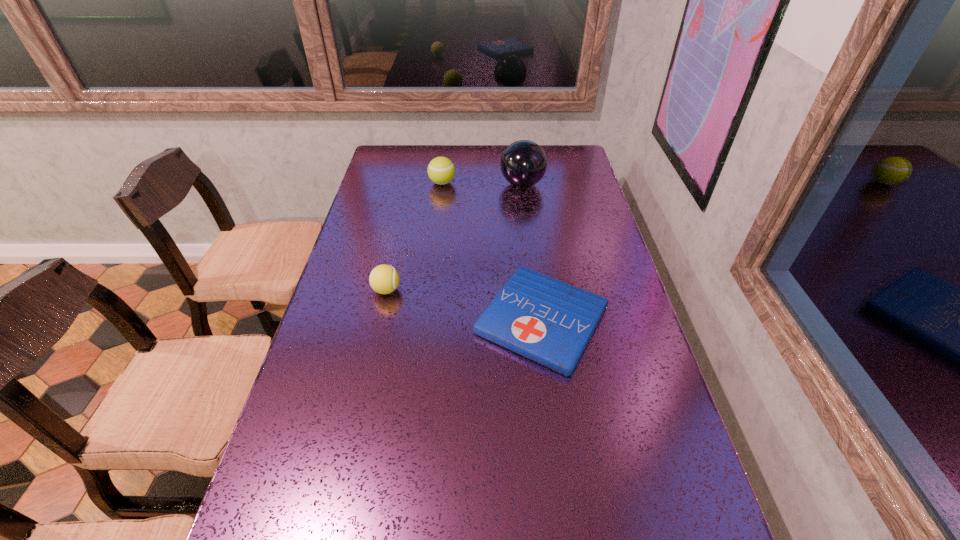
Image resolution: width=960 pixels, height=540 pixels. I want to click on bowling ball, so click(x=523, y=163).

Find the location of a particular element. This screenshot has width=960, height=540. the second tallest object is located at coordinates (441, 170).

Locate an element on the screen. This screenshot has width=960, height=540. the farther tennis ball is located at coordinates (441, 170).

Where is `the left tennis ball`? the left tennis ball is located at coordinates (384, 279).

Locate an element on the screen. This screenshot has height=540, width=960. the second shortest object is located at coordinates (384, 279).

This screenshot has height=540, width=960. I want to click on the first-aid kit, so click(546, 320).

This screenshot has height=540, width=960. I want to click on free point located 0.230m on the side of the bowling ball with the finger holes, so click(439, 184).

This screenshot has height=540, width=960. Find the location of `vacant area situated on the side of the bowling ball with the finger holes`. vacant area situated on the side of the bowling ball with the finger holes is located at coordinates (396, 184).

You are a GUI agent. You are given a task and a screenshot of the screen. Output one action in this format:
    pyautogui.click(x=<x>, y=<y>)
    Task: Click on the vacant space located on the side of the bowling ball with the finger holes
    
    Given the screenshot: What is the action you would take?
    pyautogui.click(x=439, y=184)

The height and width of the screenshot is (540, 960). I want to click on free space located on the right of the second tallest object, so click(x=509, y=183).